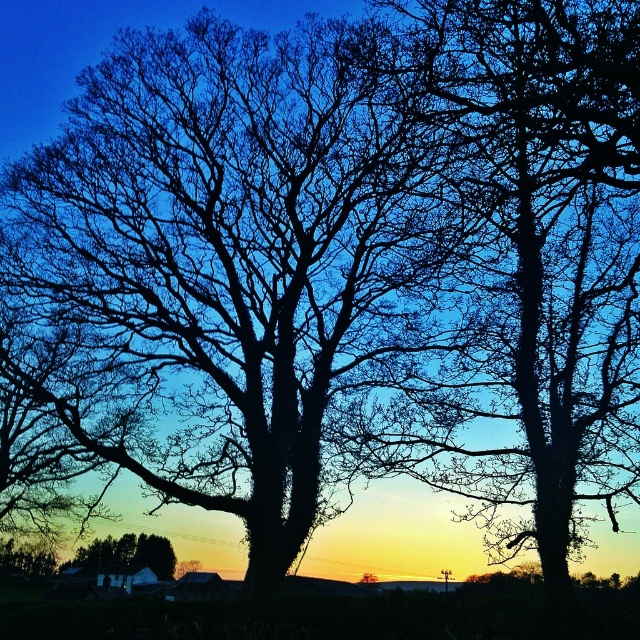
Question: Considering the relative positions of silhouette bark tree at center and smooth brown house at lower center in the image provided, where is silhouette bark tree at center located with respect to smooth brown house at lower center?

Choices:
 (A) right
 (B) left

Answer: (A)

Question: Is silhouette bark tree at center bigger than smooth brown house at lower center?

Choices:
 (A) no
 (B) yes

Answer: (B)

Question: Among these objects, which one is farthest from the camera?

Choices:
 (A) silhouette bark tree at center
 (B) smooth brown house at lower center

Answer: (B)

Question: Can you confirm if silhouette bark tree at center is positioned to the left of smooth brown house at lower center?

Choices:
 (A) yes
 (B) no

Answer: (B)